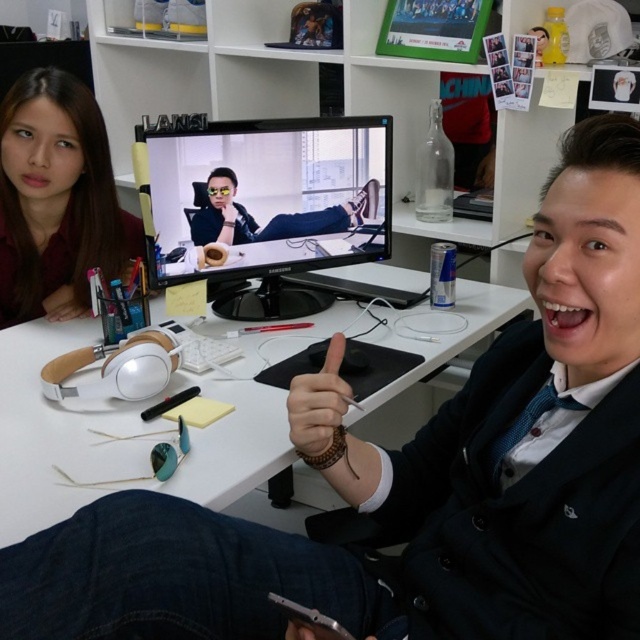
Can you confirm if white matte computer desk at center is thinner than brown leather hand at center?

Incorrect, white matte computer desk at center's width is not less than brown leather hand at center's.

Between white matte computer desk at center and brown leather hand at center, which one appears on the left side from the viewer's perspective?

white matte computer desk at center is more to the left.

Locate an element on the screen. The image size is (640, 640). white matte computer desk at center is located at coordinates (136, 428).

Is black glossy monitor at center taller than matte brown hair at upper left?

Incorrect, black glossy monitor at center's height is not larger of matte brown hair at upper left's.

Find the location of `black glossy monitor at center`. black glossy monitor at center is located at coordinates (262, 204).

Between point (372, 177) and point (67, 173), which one is positioned in front?

Positioned in front is point (67, 173).

You are a GUI agent. You are given a task and a screenshot of the screen. Output one action in this format:
    pyautogui.click(x=<x>, y=<y>)
    Task: Click on the black glossy monitor at center
    The image size is (640, 640).
    Given the screenshot: What is the action you would take?
    pyautogui.click(x=262, y=204)

Which is behind, point (164, 116) or point (326, 352)?

Positioned behind is point (164, 116).

Measure the distance between point (269, 232) and camera.

5.32 feet

Between point (163, 221) and point (323, 387), which one is positioned behind?

The point (163, 221) is behind.

Locate an element on the screen. Image resolution: width=640 pixels, height=640 pixels. black glossy monitor at center is located at coordinates (262, 204).